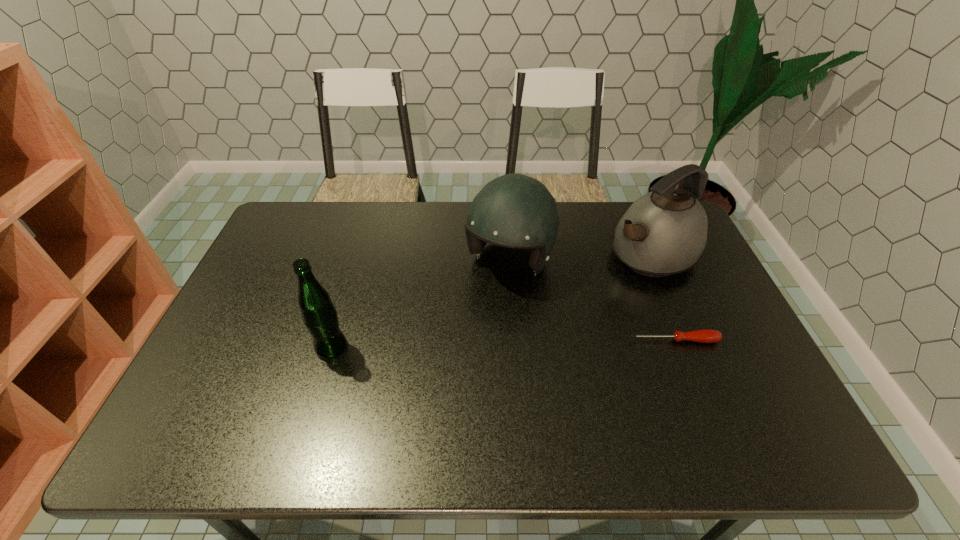
This screenshot has height=540, width=960. I want to click on vacant space on the desktop that is between the beer bottle and the screwdriver and is positioned at the face opening of the football helmet, so click(460, 345).

You are a GUI agent. You are given a task and a screenshot of the screen. Output one action in this format:
    pyautogui.click(x=<x>, y=<y>)
    Task: Click on the vacant space on the desktop that is between the leftmost object and the screwdriver and is positioned at the spout of the kettle
    
    Given the screenshot: What is the action you would take?
    pyautogui.click(x=497, y=344)